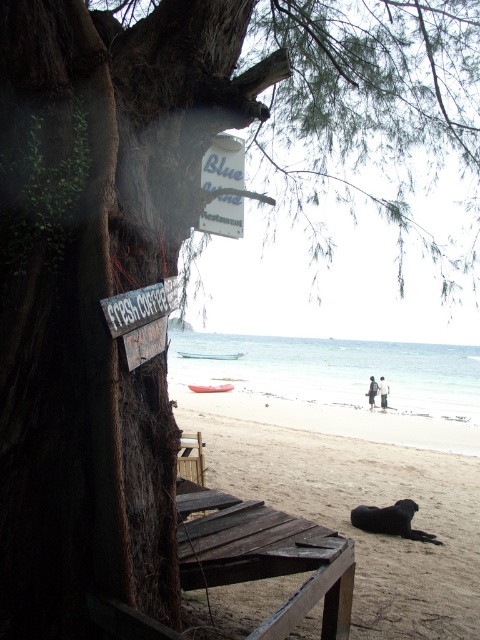
You are a visitor at the Blue Wind Restaurant and want to sit down at the weathered wood chair at lower center. The white paper sign at upper center has important information about today s specials. Can you read the sign while sitting in the chair?

The weathered wood chair at lower center is 6.42 feet away from the white paper sign at upper center. At this distance, it would be possible to read the sign while sitting in the chair, assuming the sign s text is legible from that distance.

You are standing at the entrance of the Blue Wind Restaurant and see the brown sandy beach at lower center and the weathered wood chair at lower center. Which object is positioned to the right side?

The brown sandy beach at lower center is to the right of the weathered wood chair at lower center.

You are a visitor at the Blue Wind Restaurant and want to know if the brown sandy beach at lower center is wider than the white paper sign at upper center. Can you confirm this based on the scene?

The brown sandy beach at lower center is wider than the white paper sign at upper center, so yes, it is wider.